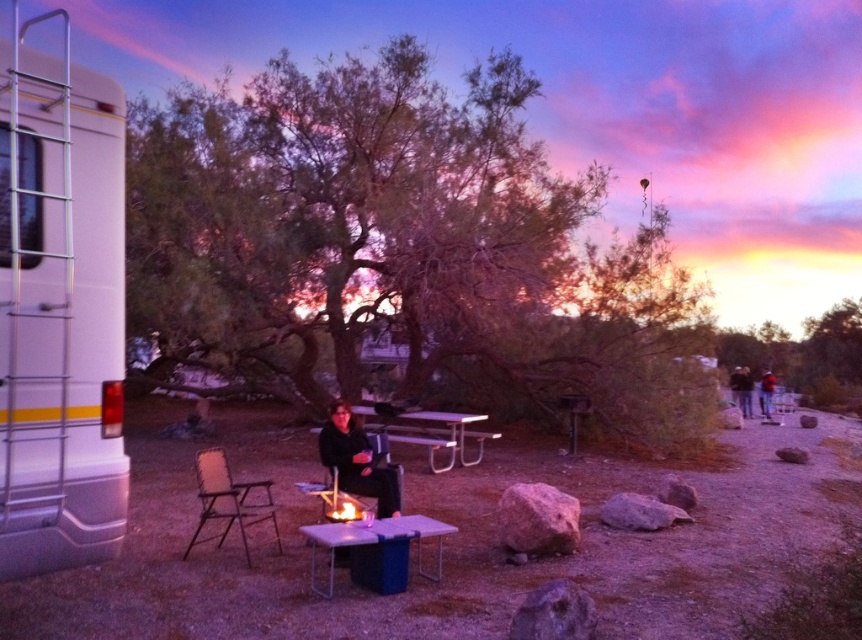
Question: Is white plastic table at center to the left of denim pants at right from the viewer's perspective?

Choices:
 (A) no
 (B) yes

Answer: (B)

Question: Which point appears closest to the camera in this image?

Choices:
 (A) (742, 365)
 (B) (117, 483)
 (C) (764, 408)
 (D) (456, 452)

Answer: (B)

Question: Is white metallic recreational vehicle at left behind metallic silver picnic table at center?

Choices:
 (A) yes
 (B) no

Answer: (B)

Question: Which object appears closest to the camera in this image?

Choices:
 (A) metallic silver picnic table at center
 (B) metallic folding chair at lower left
 (C) denim pants at right
 (D) dark blue jeans at right

Answer: (B)

Question: Is black fabric jacket at center above white plastic table at center?

Choices:
 (A) no
 (B) yes

Answer: (B)

Question: Which point is farther to the camera?

Choices:
 (A) (504, 184)
 (B) (322, 531)
 (C) (750, 401)
 (D) (357, 435)

Answer: (C)